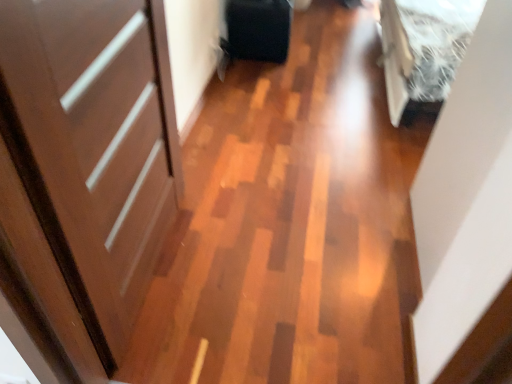
You are a GUI agent. You are given a task and a screenshot of the screen. Output one action in this format:
    pyautogui.click(x=<x>, y=<y>)
    Task: Click on the free region under matte brown door at left (from a real-world perspective)
    This screenshot has height=384, width=512.
    Given the screenshot: What is the action you would take?
    pyautogui.click(x=162, y=274)